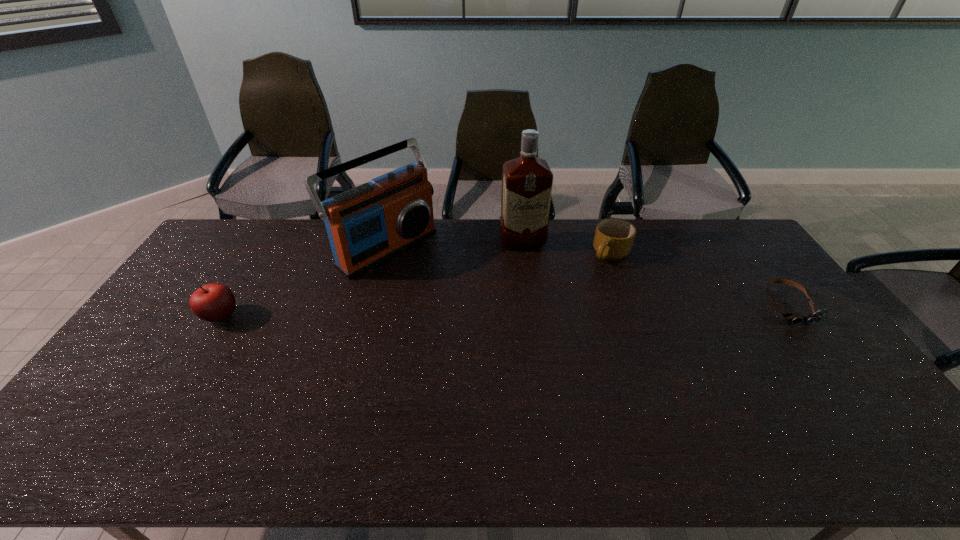
Where is `unoccupied position between the leftmost object and the mug`? The width and height of the screenshot is (960, 540). unoccupied position between the leftmost object and the mug is located at coordinates (416, 285).

Locate which object ranks third in proximity to the fourth object from left to right. Please provide its 2D coordinates. Your answer should be formatted as a tuple, i.e. [(x, y)], where the tuple contains the x and y coordinates of a point satisfying the conditions above.

[(373, 222)]

Where is `object that stands as the closest to the leftmost object`? The height and width of the screenshot is (540, 960). object that stands as the closest to the leftmost object is located at coordinates (373, 222).